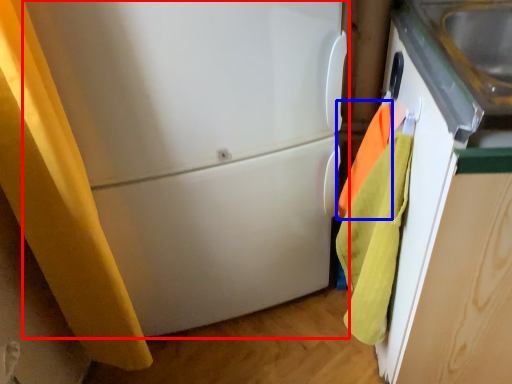
Question: Which point is further to the camera, refrigerator (highlighted by a red box) or beach towel (highlighted by a blue box)?

Choices:
 (A) refrigerator
 (B) beach towel

Answer: (B)